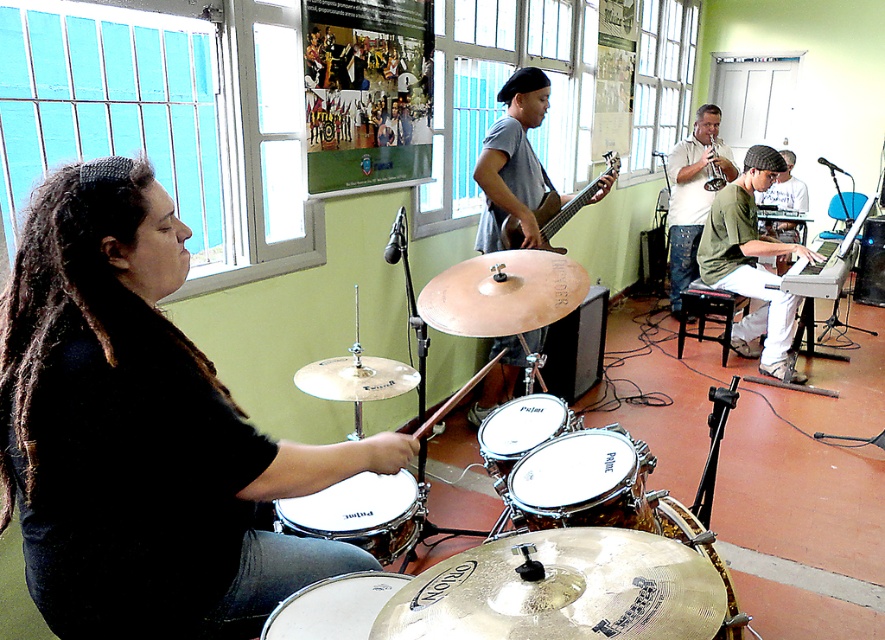
Can you confirm if black matte drum set at left is smaller than white mesh drum at center?

Actually, black matte drum set at left might be larger than white mesh drum at center.

Locate an element on the screen. Image resolution: width=885 pixels, height=640 pixels. black matte drum set at left is located at coordinates (140, 432).

Which is in front, point (108, 188) or point (504, 419)?

Point (108, 188)

Locate an element on the screen. Image resolution: width=885 pixels, height=640 pixels. black matte drum set at left is located at coordinates (140, 432).

Does white leather drum at lower left appear on the left side of matte gray shirt at upper right?

Yes, white leather drum at lower left is to the left of matte gray shirt at upper right.

Is white leather drum at lower left bigger than matte gray shirt at upper right?

Incorrect, white leather drum at lower left is not larger than matte gray shirt at upper right.

Measure the distance between white leather drum at lower left and camera.

The distance of white leather drum at lower left from camera is 1.71 meters.

The image size is (885, 640). I want to click on white leather drum at lower left, so click(x=358, y=513).

Is white leather drum at lower left smaller than white matte drum at lower center?

Actually, white leather drum at lower left might be larger than white matte drum at lower center.

Locate an element on the screen. white leather drum at lower left is located at coordinates (358, 513).